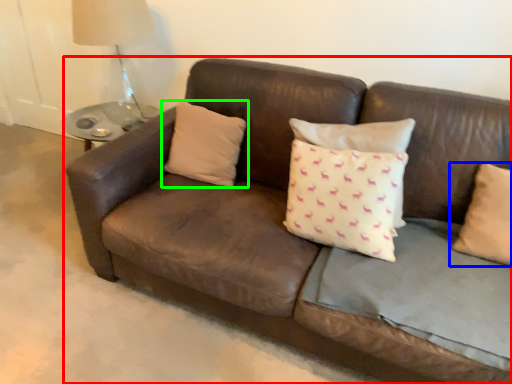
Question: Which object is positioned farthest from studio couch (highlighted by a red box)? Select from pillow (highlighted by a blue box) and pillow (highlighted by a green box).

Choices:
 (A) pillow
 (B) pillow

Answer: (A)